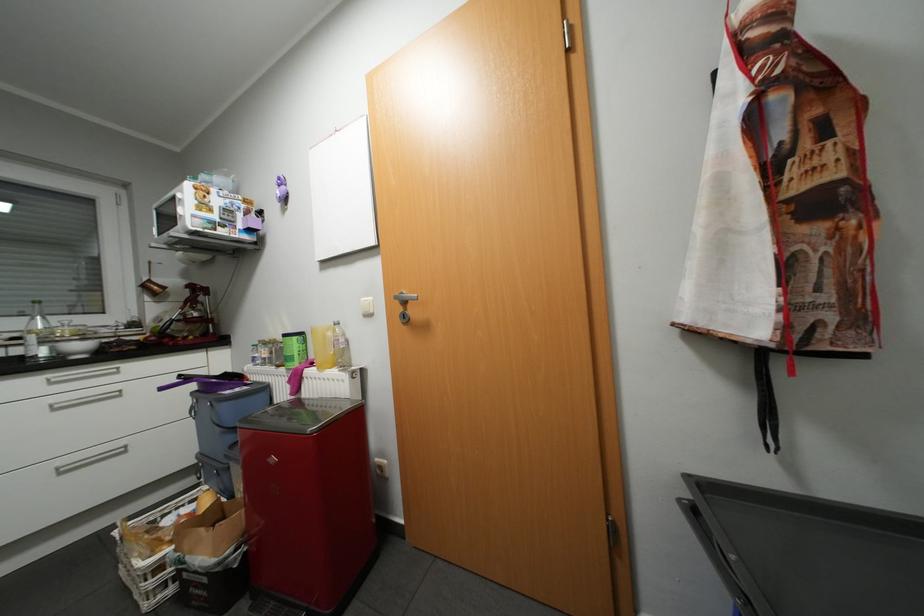
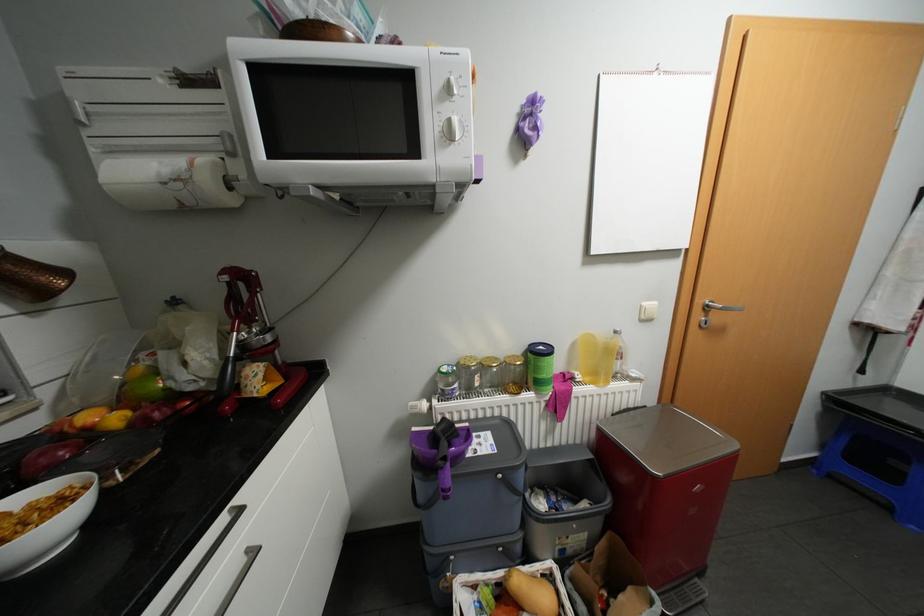
Locate, in the second image, the point that corresponds to (91,346) in the first image.

(44, 522)